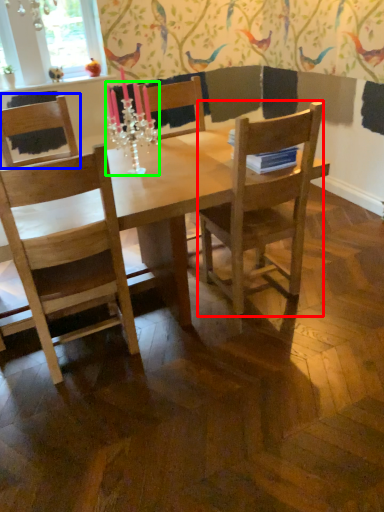
Question: Which object is positioned closest to chair (highlighted by a red box)? Select from chair (highlighted by a blue box) and candle holder (highlighted by a green box).

Choices:
 (A) chair
 (B) candle holder

Answer: (B)